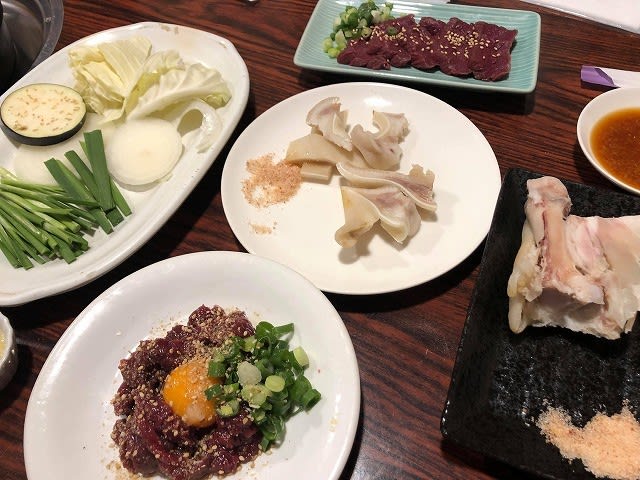
The height and width of the screenshot is (480, 640). I want to click on plates, so click(x=338, y=366), click(x=442, y=257), click(x=512, y=75), click(x=150, y=216), click(x=464, y=394).